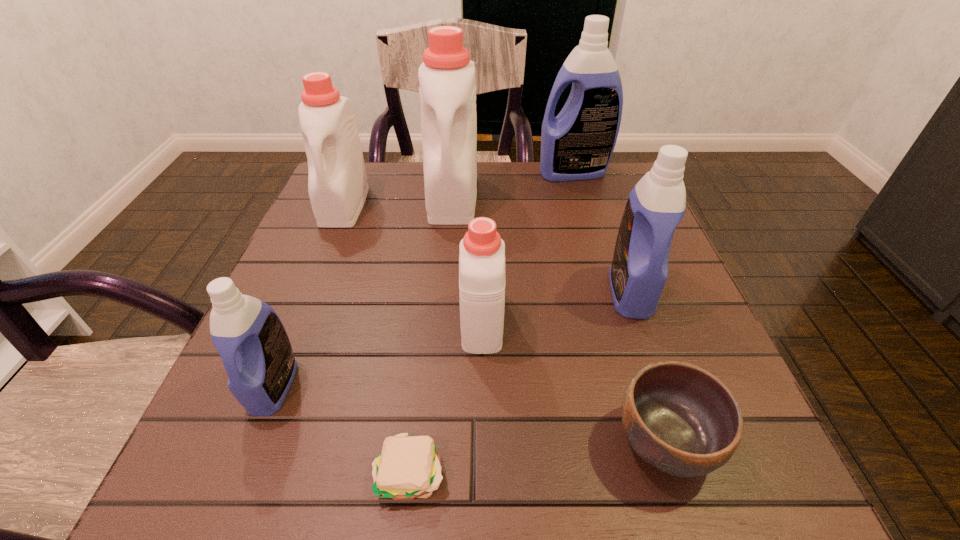
Identify the location of blank space located 0.300m on the front of the farthest blue detergent. (599, 257).

Where is `free space located on the handle side of the leftmost white detergent`? This screenshot has height=540, width=960. free space located on the handle side of the leftmost white detergent is located at coordinates (287, 349).

Where is `free point located 0.250m on the front of the second nearest blue detergent`? free point located 0.250m on the front of the second nearest blue detergent is located at coordinates (687, 456).

At what (x,y) coordinates should I click in order to perform the action: click on vacant region located 0.170m on the handle side of the nearest white detergent. Please return your answer as a coordinate pair (x, y). Looking at the image, I should click on (482, 238).

At what (x,y) coordinates should I click in order to perform the action: click on vacant region located on the handle side of the nearest white detergent. Please return your answer as a coordinate pair (x, y). The image size is (960, 540). Looking at the image, I should click on (482, 275).

Find the location of a particular element. This screenshot has width=960, height=540. free space located 0.140m on the handle side of the nearest white detergent is located at coordinates (482, 247).

At what (x,y) coordinates should I click in order to perform the action: click on vacant space located on the back of the smallest blue detergent. Please return your answer as a coordinate pair (x, y). The image size is (960, 540). Looking at the image, I should click on (296, 330).

Where is `vacant space positioned 0.250m on the left of the bowl`? vacant space positioned 0.250m on the left of the bowl is located at coordinates (440, 442).

The image size is (960, 540). Find the location of `vacant space situated 0.250m on the right of the shortest object`. vacant space situated 0.250m on the right of the shortest object is located at coordinates (628, 472).

Locate an element on the screen. bowl present at the near edge is located at coordinates (680, 419).